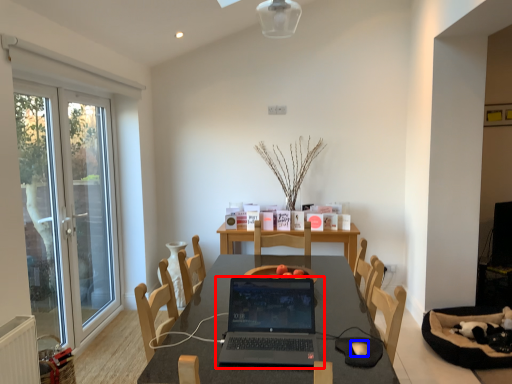
Question: Which object is closer to the camera taking this photo, laptop (highlighted by a red box) or mouse (highlighted by a blue box)?

Choices:
 (A) laptop
 (B) mouse

Answer: (A)